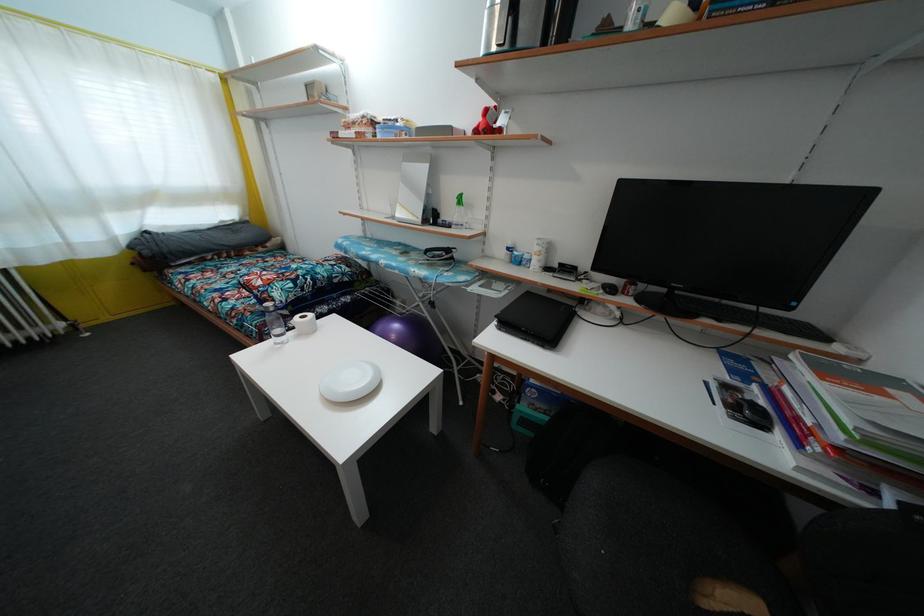
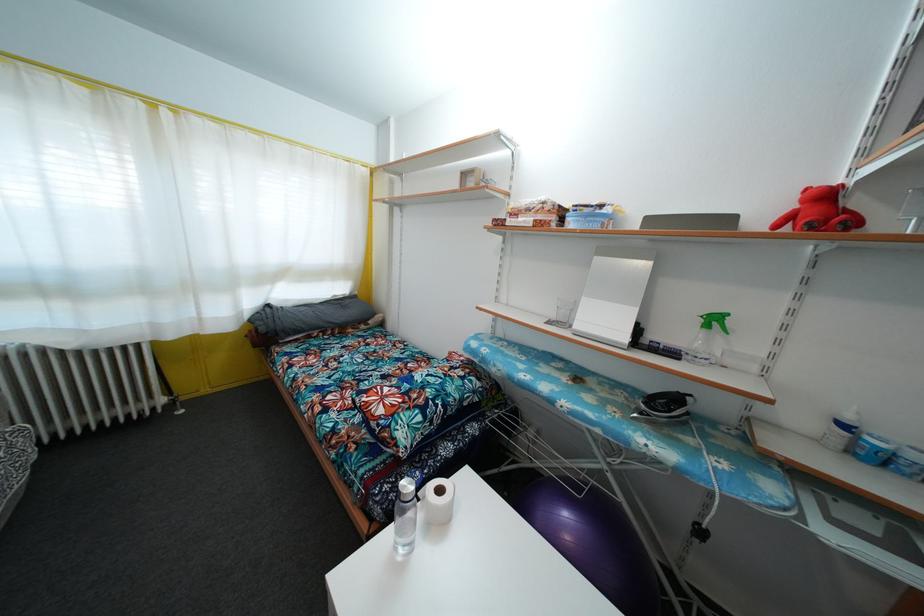
Question: I am providing you with two images of the same scene from different viewpoints. Please identify which objects are invisible in image2.

Choices:
 (A) green spray trigger
 (B) clear water bottle
 (C) grey pillow
 (D) none of these

Answer: (D)